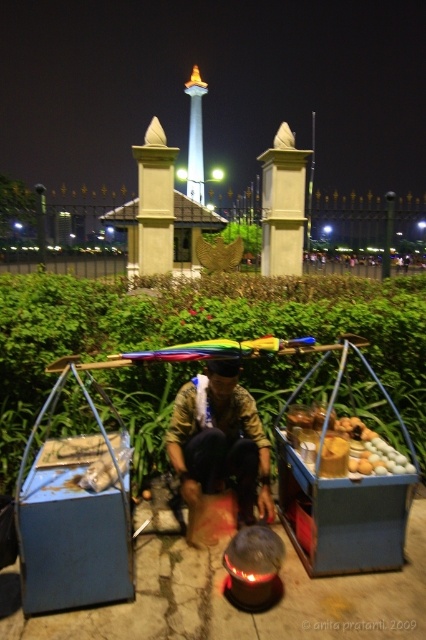
Is smooth wooden tray at center bigger than shiny glass tower at center?

Actually, smooth wooden tray at center might be smaller than shiny glass tower at center.

Between smooth wooden tray at center and shiny glass tower at center, which one appears on the right side from the viewer's perspective?

From the viewer's perspective, smooth wooden tray at center appears more on the right side.

What do you see at coordinates (368, 449) in the screenshot? I see `smooth wooden tray at center` at bounding box center [368, 449].

Locate an element on the screen. This screenshot has width=426, height=640. smooth wooden tray at center is located at coordinates (368, 449).

Which is above, camouflage fabric at center or shiny glass tower at center?

shiny glass tower at center is higher up.

Does camouflage fabric at center come in front of shiny glass tower at center?

Yes, it is.

The width and height of the screenshot is (426, 640). What do you see at coordinates (218, 444) in the screenshot? I see `camouflage fabric at center` at bounding box center [218, 444].

Where is `camouflage fabric at center`? The width and height of the screenshot is (426, 640). camouflage fabric at center is located at coordinates (218, 444).

Which is more to the right, camouflage fabric at center or smooth wooden tray at center?

smooth wooden tray at center

Who is more forward, (193, 378) or (331, 451)?

Positioned in front is point (331, 451).

Does point (175, 444) come closer to viewer compared to point (394, 458)?

No, (175, 444) is further to viewer.

Where is `camouflage fabric at center`? This screenshot has width=426, height=640. camouflage fabric at center is located at coordinates (218, 444).